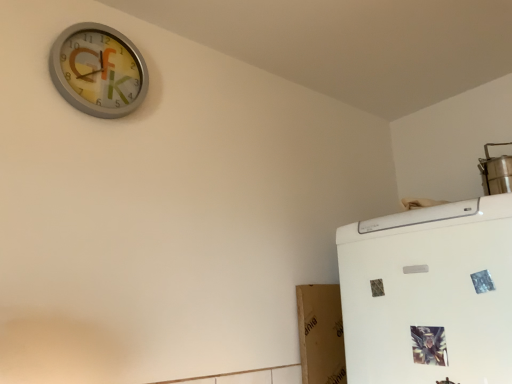
Question: Is metallic silver clock at upper left situated inside stainless steel steamer at upper right or outside?

Choices:
 (A) inside
 (B) outside

Answer: (B)

Question: From the image's perspective, is metallic silver clock at upper left located above or below stainless steel steamer at upper right?

Choices:
 (A) above
 (B) below

Answer: (A)

Question: Relative to stainless steel steamer at upper right, is metallic silver clock at upper left in front or behind?

Choices:
 (A) behind
 (B) front

Answer: (B)

Question: Based on their sizes in the image, would you say stainless steel steamer at upper right is bigger or smaller than metallic silver clock at upper left?

Choices:
 (A) big
 (B) small

Answer: (A)

Question: Considering the positions of stainless steel steamer at upper right and metallic silver clock at upper left in the image, is stainless steel steamer at upper right wider or thinner than metallic silver clock at upper left?

Choices:
 (A) thin
 (B) wide

Answer: (B)

Question: Would you say stainless steel steamer at upper right is to the left or to the right of metallic silver clock at upper left in the picture?

Choices:
 (A) right
 (B) left

Answer: (A)

Question: Would you say stainless steel steamer at upper right is inside or outside metallic silver clock at upper left?

Choices:
 (A) outside
 (B) inside

Answer: (A)